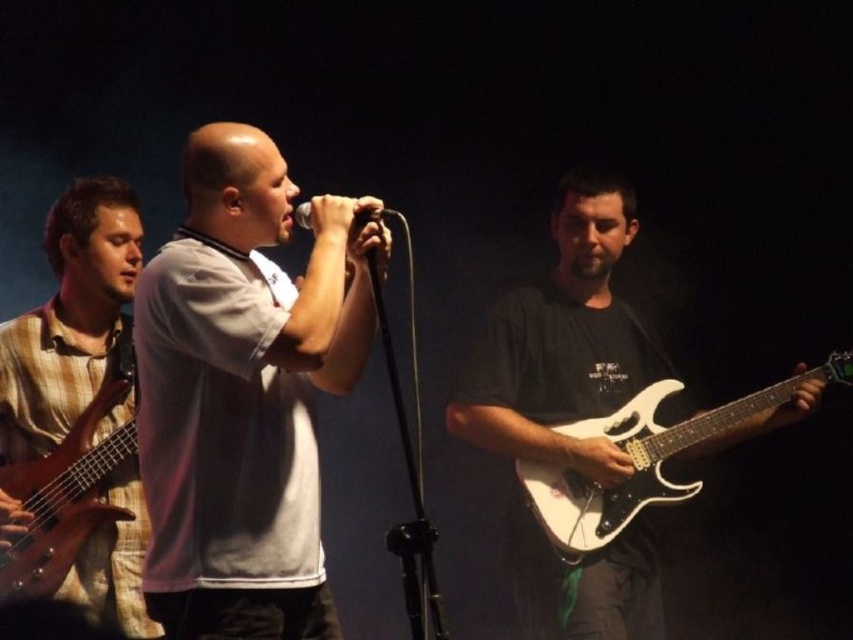
Is white matte shirt at center smaller than wooden bass guitar at left?

Actually, white matte shirt at center might be larger than wooden bass guitar at left.

Does point (209, 531) lie behind point (109, 412)?

No.

The image size is (853, 640). What do you see at coordinates (242, 394) in the screenshot? I see `white matte shirt at center` at bounding box center [242, 394].

Find the location of `white matte shirt at center`. white matte shirt at center is located at coordinates (242, 394).

From the picture: Measure the distance from white glossy guitar at right to plaid fabric guitar at left.

white glossy guitar at right is 4.48 feet from plaid fabric guitar at left.

Describe the element at coordinates (561, 340) in the screenshot. I see `white glossy guitar at right` at that location.

Find the location of a particular element. The width and height of the screenshot is (853, 640). white glossy guitar at right is located at coordinates (561, 340).

Who is positioned more to the left, white matte shirt at center or white glossy guitar at right?

From the viewer's perspective, white matte shirt at center appears more on the left side.

Who is lower down, white matte shirt at center or white glossy guitar at right?

white glossy guitar at right

Identify the location of white matte shirt at center. click(242, 394).